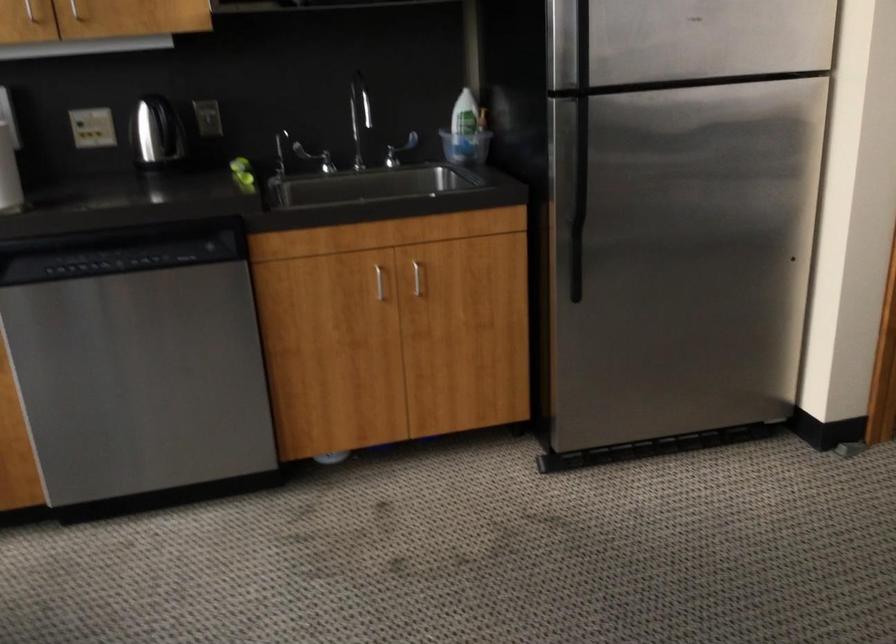
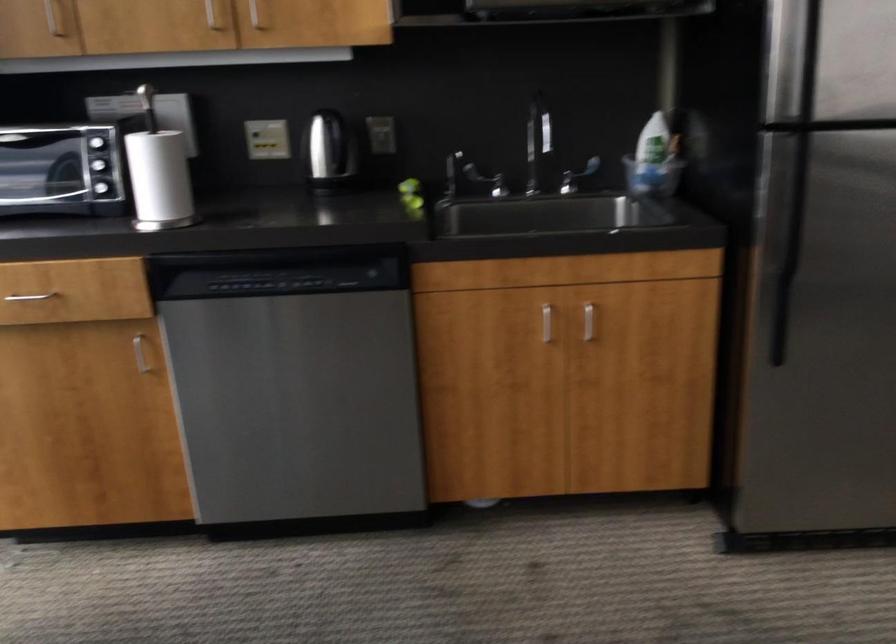
In the second image, find the point that corresponds to [582,142] in the first image.

(797, 181)